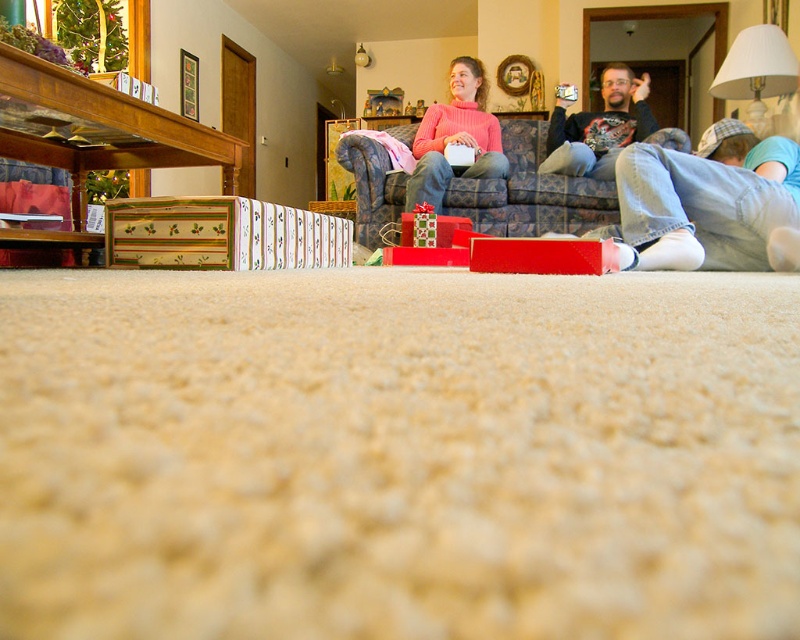
Question: Which of these objects is positioned farthest from the matte pink sweater at center?

Choices:
 (A) matte black shirt at center
 (B) patterned fabric couch at center

Answer: (A)

Question: Considering the real-world distances, which object is farthest from the matte pink sweater at center?

Choices:
 (A) patterned fabric couch at center
 (B) matte black shirt at center

Answer: (B)

Question: Does patterned fabric couch at center appear on the right side of matte black shirt at center?

Choices:
 (A) no
 (B) yes

Answer: (A)

Question: Can you confirm if matte pink sweater at center is positioned to the right of matte black shirt at center?

Choices:
 (A) no
 (B) yes

Answer: (A)

Question: Which point is farther to the camera?

Choices:
 (A) matte black shirt at center
 (B) matte pink sweater at center
 (C) patterned fabric couch at center

Answer: (A)

Question: Is patterned fabric couch at center to the right of matte black shirt at center from the viewer's perspective?

Choices:
 (A) no
 (B) yes

Answer: (A)